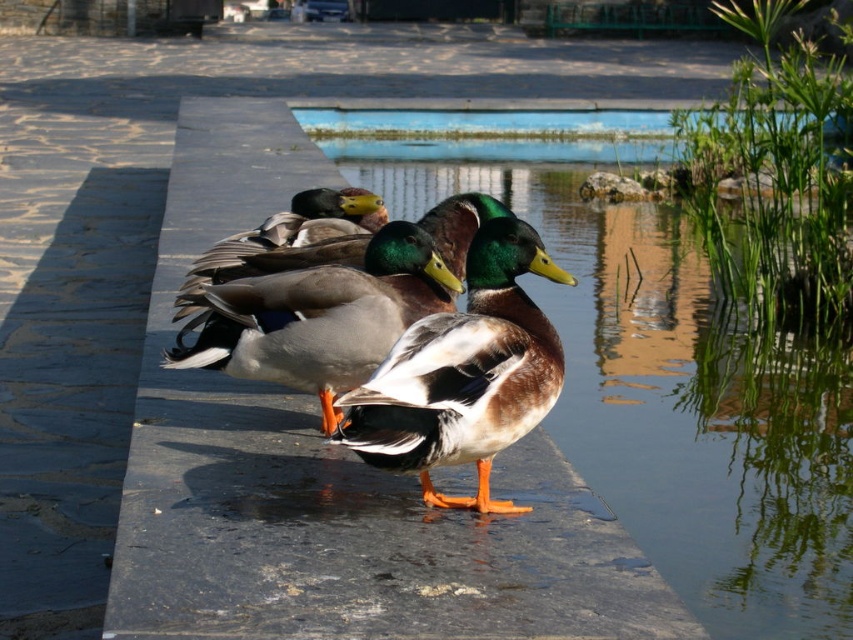
Question: Among these points, which one is farthest from the camera?

Choices:
 (A) (259, 321)
 (B) (410, 340)
 (C) (379, 125)

Answer: (C)

Question: Can you confirm if shiny brown duck at center is positioned above brown glossy duck at center?

Choices:
 (A) no
 (B) yes

Answer: (A)

Question: Can you confirm if smooth stone ledge at center is positioned above brown glossy duck at center?

Choices:
 (A) no
 (B) yes

Answer: (B)

Question: Which object appears farthest from the camera in this image?

Choices:
 (A) smooth stone ledge at center
 (B) shiny brown duck at center
 (C) blue concrete pool at center
 (D) brown glossy duck at center

Answer: (C)

Question: Which of the following is the closest to the observer?

Choices:
 (A) shiny brown duck at center
 (B) brown glossy duck at center
 (C) smooth stone ledge at center
 (D) blue concrete pool at center

Answer: (C)

Question: Is shiny brown duck at center to the left of blue concrete pool at center from the viewer's perspective?

Choices:
 (A) no
 (B) yes

Answer: (B)